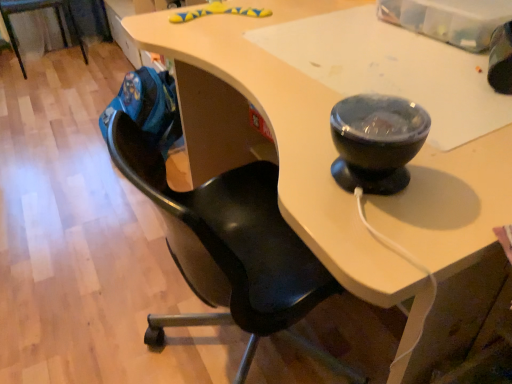
Describe the element at coordinates (229, 248) in the screenshot. I see `black matte chair at center, which is counted as the 1th chair, starting from the bottom` at that location.

You are a GUI agent. You are given a task and a screenshot of the screen. Output one action in this format:
    pyautogui.click(x=<x>, y=<y>)
    Task: Click on the black matte chair at center, which is counted as the first chair, starting from the front
    This screenshot has height=384, width=512.
    Given the screenshot: What is the action you would take?
    pyautogui.click(x=229, y=248)

Measure the distance between point (259, 242) and camera.

Point (259, 242) and camera are 1.02 meters apart.

Describe the element at coordinates (34, 10) in the screenshot. I see `black leather chair at left, the 2th chair viewed from the front` at that location.

Image resolution: width=512 pixels, height=384 pixels. What are the coordinates of `black leather chair at left, the second chair viewed from the right` in the screenshot? It's located at (34, 10).

Find the location of a particular element. black matte chair at center, which is counted as the 1th chair, starting from the right is located at coordinates (229, 248).

Considering the relative positions of black leather chair at left, marked as the 2th chair in a bottom-to-top arrangement, and black matte chair at center, which is counted as the 2th chair, starting from the back, in the image provided, is black leather chair at left, marked as the 2th chair in a bottom-to-top arrangement, to the left of black matte chair at center, which is counted as the 2th chair, starting from the back, from the viewer's perspective?

Yes, black leather chair at left, marked as the 2th chair in a bottom-to-top arrangement, is to the left of black matte chair at center, which is counted as the 2th chair, starting from the back.

Considering the positions of objects black leather chair at left, marked as the 2th chair in a bottom-to-top arrangement, and black matte chair at center, which is counted as the 1th chair, starting from the bottom, in the image provided, who is in front, black leather chair at left, marked as the 2th chair in a bottom-to-top arrangement, or black matte chair at center, which is counted as the 1th chair, starting from the bottom,?

black matte chair at center, which is counted as the 1th chair, starting from the bottom, is closer to the camera.

Considering the positions of points (83, 51) and (285, 336), is point (83, 51) closer to camera compared to point (285, 336)?

No, it is behind (285, 336).

From the image's perspective, is black leather chair at left, the 2th chair viewed from the front, below black matte chair at center, acting as the second chair starting from the top?

No.

From a real-world perspective, does black leather chair at left, the second chair viewed from the right, sit lower than black matte chair at center, which is counted as the 2th chair, starting from the back?

Yes, from a real-world perspective, black leather chair at left, the second chair viewed from the right, is under black matte chair at center, which is counted as the 2th chair, starting from the back.

Considering the relative sizes of black leather chair at left, positioned as the first chair in left-to-right order, and black matte chair at center, which is counted as the 1th chair, starting from the right, in the image provided, is black leather chair at left, positioned as the first chair in left-to-right order, thinner than black matte chair at center, which is counted as the 1th chair, starting from the right,?

In fact, black leather chair at left, positioned as the first chair in left-to-right order, might be wider than black matte chair at center, which is counted as the 1th chair, starting from the right.

Who is taller, black leather chair at left, which is counted as the 1th chair, starting from the back, or black matte chair at center, acting as the second chair starting from the top?

With more height is black matte chair at center, acting as the second chair starting from the top.

Looking at the image, does black leather chair at left, marked as the 2th chair in a bottom-to-top arrangement, seem bigger or smaller compared to black matte chair at center, which is counted as the 2th chair, starting from the back?

black leather chair at left, marked as the 2th chair in a bottom-to-top arrangement, is smaller than black matte chair at center, which is counted as the 2th chair, starting from the back.

Do you think black leather chair at left, the second chair viewed from the right, is within black matte chair at center, acting as the second chair starting from the top, or outside of it?

black leather chair at left, the second chair viewed from the right, is located beyond the bounds of black matte chair at center, acting as the second chair starting from the top.

Is black leather chair at left, which is the first chair from top to bottom, directly adjacent to black matte chair at center, which is counted as the first chair, starting from the front?

There is a gap between black leather chair at left, which is the first chair from top to bottom, and black matte chair at center, which is counted as the first chair, starting from the front.

Could you tell me if black leather chair at left, which is the first chair from top to bottom, is facing black matte chair at center, which is counted as the 1th chair, starting from the right?

Yes, black leather chair at left, which is the first chair from top to bottom, is facing black matte chair at center, which is counted as the 1th chair, starting from the right.

How many degrees apart are the facing directions of black leather chair at left, marked as the 2th chair in a bottom-to-top arrangement, and black matte chair at center, acting as the second chair starting from the top?

The angle between the facing direction of black leather chair at left, marked as the 2th chair in a bottom-to-top arrangement, and the facing direction of black matte chair at center, acting as the second chair starting from the top, is 89.4 degrees.

This screenshot has width=512, height=384. Identify the location of chair behind the black matte chair at center, which is counted as the first chair, starting from the front. (34, 10).

In the image, is black matte chair at center, which is counted as the first chair, starting from the front, on the left side or the right side of black leather chair at left, which is the first chair from top to bottom?

black matte chair at center, which is counted as the first chair, starting from the front, is to the right of black leather chair at left, which is the first chair from top to bottom.

Which object is more forward, black matte chair at center, which is counted as the first chair, starting from the front, or black leather chair at left, which is counted as the 1th chair, starting from the back?

Positioned in front is black matte chair at center, which is counted as the first chair, starting from the front.

Is point (194, 325) closer to viewer compared to point (14, 49)?

Yes, it is.

From the image's perspective, is black matte chair at center, which is counted as the 1th chair, starting from the right, beneath black leather chair at left, the second chair viewed from the right?

Yes.

From a real-world perspective, is black matte chair at center, which is counted as the first chair, starting from the front, physically located above or below black leather chair at left, which is the first chair from top to bottom?

From a real-world perspective, black matte chair at center, which is counted as the first chair, starting from the front, is physically above black leather chair at left, which is the first chair from top to bottom.

Looking at their sizes, would you say black matte chair at center, which is counted as the 1th chair, starting from the bottom, is wider or thinner than black leather chair at left, positioned as the first chair in left-to-right order?

In the image, black matte chair at center, which is counted as the 1th chair, starting from the bottom, appears to be more narrow than black leather chair at left, positioned as the first chair in left-to-right order.

Can you confirm if black matte chair at center, acting as the second chair starting from the top, is taller than black leather chair at left, which is counted as the 1th chair, starting from the back?

Yes, black matte chair at center, acting as the second chair starting from the top, is taller than black leather chair at left, which is counted as the 1th chair, starting from the back.

Is black matte chair at center, which is counted as the 1th chair, starting from the bottom, bigger or smaller than black leather chair at left, positioned as the first chair in left-to-right order?

Clearly, black matte chair at center, which is counted as the 1th chair, starting from the bottom, is larger in size than black leather chair at left, positioned as the first chair in left-to-right order.

Choose the correct answer: Is black matte chair at center, which is counted as the 1th chair, starting from the bottom, inside black leather chair at left, the 2th chair viewed from the front, or outside it?

black matte chair at center, which is counted as the 1th chair, starting from the bottom, cannot be found inside black leather chair at left, the 2th chair viewed from the front.

Is black matte chair at center, which is counted as the first chair, starting from the front, not close to black leather chair at left, which is the first chair from top to bottom?

Absolutely, black matte chair at center, which is counted as the first chair, starting from the front, is distant from black leather chair at left, which is the first chair from top to bottom.

Looking at this image, could you tell me if black matte chair at center, the 2th chair from the left, is turned towards black leather chair at left, the 2th chair viewed from the front?

No.

Measure the distance between black matte chair at center, which is counted as the first chair, starting from the front, and black leather chair at left, the 2th chair viewed from the front.

black matte chair at center, which is counted as the first chair, starting from the front, and black leather chair at left, the 2th chair viewed from the front, are 2.60 meters apart.

The width and height of the screenshot is (512, 384). In order to click on chair that is above the black leather chair at left, positioned as the first chair in left-to-right order (from a real-world perspective) in this screenshot , I will do `click(229, 248)`.

Find the location of a particular element. chair that is behind the black matte chair at center, which is counted as the 1th chair, starting from the right is located at coordinates (34, 10).

In the image, there is a black leather chair at left, the 2th chair viewed from the front. Where is `chair below it (from the image's perspective)`? This screenshot has width=512, height=384. chair below it (from the image's perspective) is located at coordinates (229, 248).